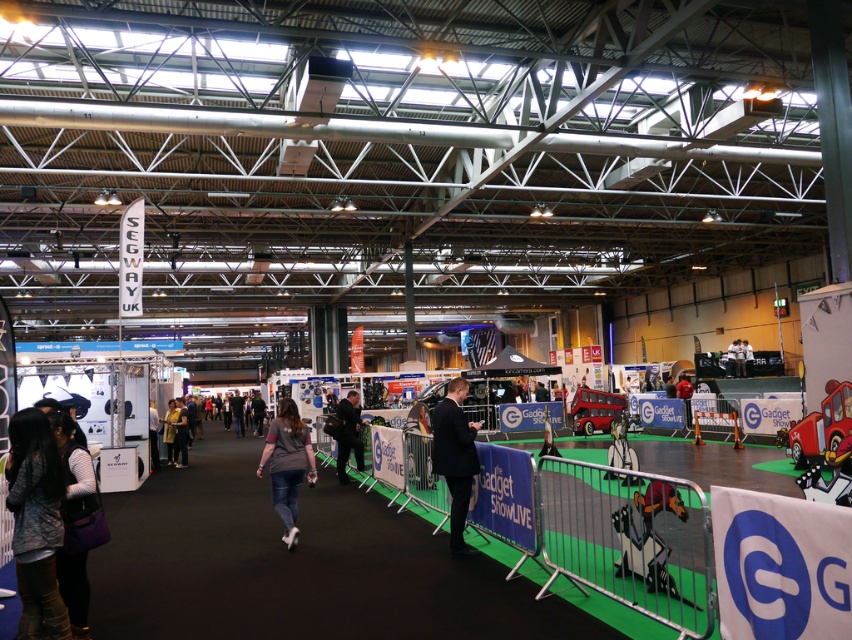
Is matte gray jacket at center shorter than yellow fabric jacket at center?

Incorrect, matte gray jacket at center's height does not fall short of yellow fabric jacket at center's.

Who is more forward, (355, 394) or (177, 456)?

Positioned in front is point (355, 394).

Where is `matte gray jacket at center`? matte gray jacket at center is located at coordinates (348, 435).

The width and height of the screenshot is (852, 640). In order to click on matte gray jacket at center in this screenshot , I will do `click(348, 435)`.

The image size is (852, 640). I want to click on purple fabric bag at lower left, so click(73, 467).

Can you confirm if purple fabric bag at lower left is positioned to the left of dark blue suit at center?

Yes, purple fabric bag at lower left is to the left of dark blue suit at center.

Who is more forward, (70, 602) or (461, 538)?

Point (70, 602) is more forward.

The image size is (852, 640). Find the location of `purple fabric bag at lower left`. purple fabric bag at lower left is located at coordinates (73, 467).

Measure the distance from jeans at center to yellow fabric jacket at center.

The distance of jeans at center from yellow fabric jacket at center is 10.89 meters.

Between point (291, 412) and point (182, 428), which one is positioned behind?

Point (182, 428)

Where is `jeans at center`? This screenshot has height=640, width=852. jeans at center is located at coordinates (286, 465).